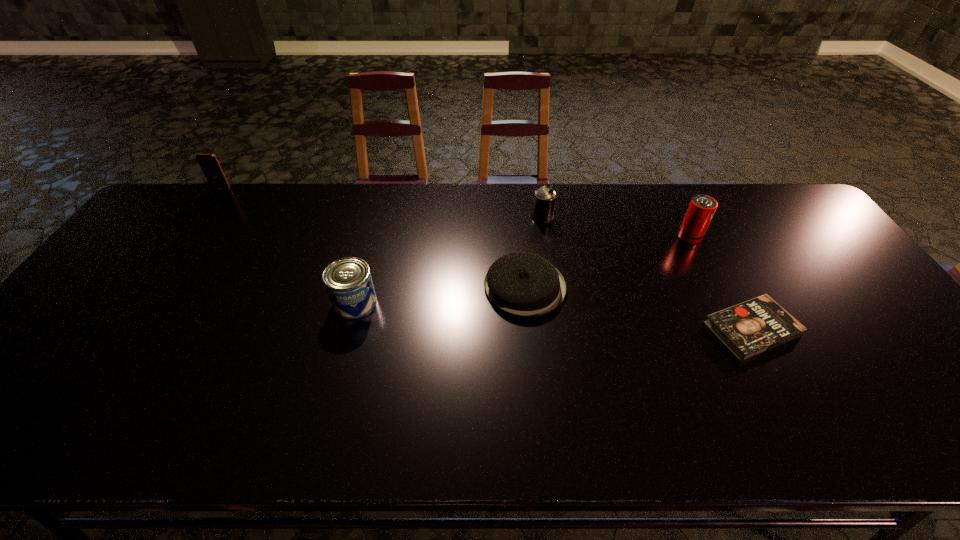
Locate an element on the screen. vacant space located on the screen of the farthest object is located at coordinates (170, 264).

Identify the location of vacant space located 0.120m on the right of the rightmost can. The image size is (960, 540). (740, 237).

You are a GUI agent. You are given a task and a screenshot of the screen. Output one action in this format:
    pyautogui.click(x=<x>, y=<y>)
    Task: Click on the vacant space located 0.300m on the right of the farthest can
    The height and width of the screenshot is (540, 960).
    Given the screenshot: What is the action you would take?
    pyautogui.click(x=646, y=217)

Image resolution: width=960 pixels, height=540 pixels. In order to click on vacant space located 0.180m on the front label of the fifth object from right to left in this screenshot , I will do `click(334, 381)`.

At what (x,y) coordinates should I click in order to perform the action: click on vacant area located 0.280m on the right of the pancake. Please return your answer as a coordinate pair (x, y). Looking at the image, I should click on (668, 287).

Find the location of a particular element. Image resolution: width=960 pixels, height=540 pixels. blank space located on the right of the book is located at coordinates (885, 329).

Where is `cellular telephone that is at the far edge`? The image size is (960, 540). cellular telephone that is at the far edge is located at coordinates (209, 164).

Where is `can that is at the far edge`? can that is at the far edge is located at coordinates (544, 202).

Where is `object present at the left edge`? object present at the left edge is located at coordinates [x=209, y=164].

Locate an element on the screen. The image size is (960, 540). object positioned at the far left corner is located at coordinates (209, 164).